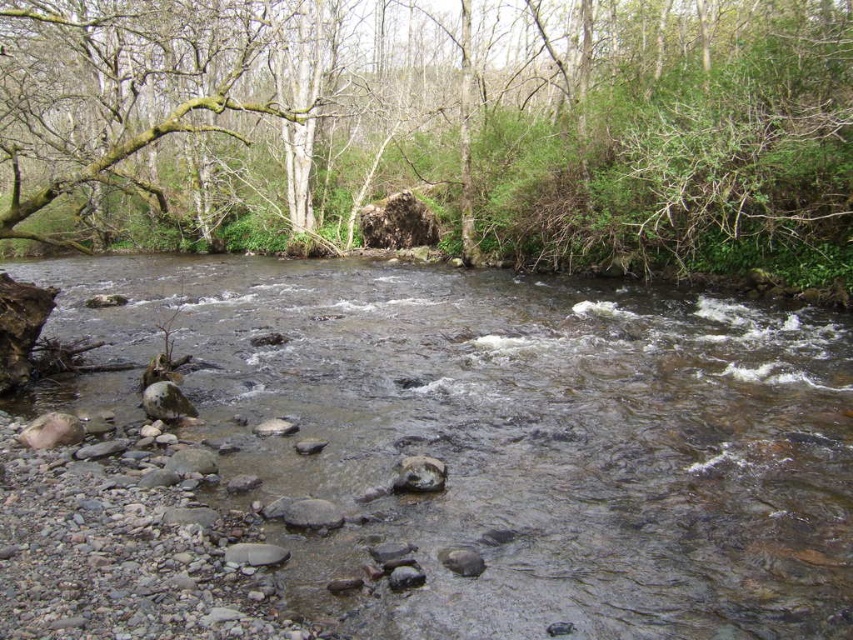
Question: Observing the image, what is the correct spatial positioning of clear water at center in reference to gray smooth rock at center?

Choices:
 (A) below
 (B) above

Answer: (B)

Question: Which point is closer to the camera?

Choices:
 (A) click(405, 467)
 (B) click(811, 557)
 (C) click(279, 68)

Answer: (B)

Question: Among these objects, which one is nearest to the camera?

Choices:
 (A) clear water at center
 (B) green leafy tree at upper center
 (C) gray smooth rock at center

Answer: (A)

Question: Does clear water at center have a lesser width compared to green leafy tree at upper center?

Choices:
 (A) yes
 (B) no

Answer: (A)

Question: Estimate the real-world distances between objects in this image. Which object is farther from the green leafy tree at upper center?

Choices:
 (A) gray smooth rock at center
 (B) clear water at center

Answer: (A)

Question: Is clear water at center to the left of gray smooth rock at center from the viewer's perspective?

Choices:
 (A) no
 (B) yes

Answer: (A)